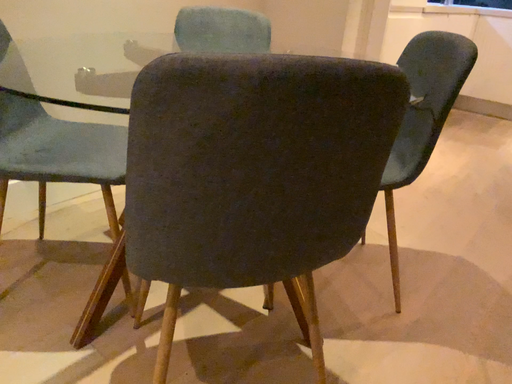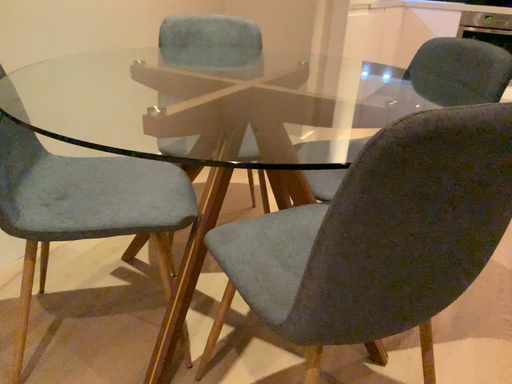
Question: How did the camera likely rotate when shooting the video?

Choices:
 (A) rotated left
 (B) rotated right

Answer: (B)